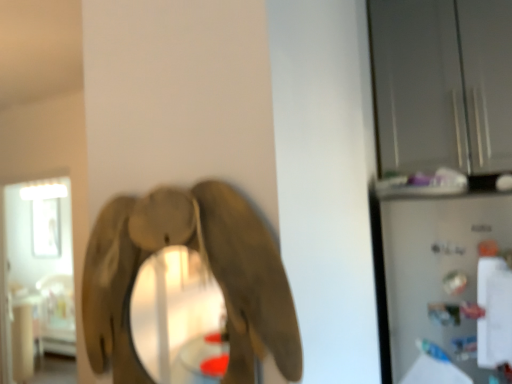
Question: Is transparent glass cabinet at upper right, marked as the 2th glass door in a bottom-to-top arrangement, completely or partially outside of wooden elephant at center?

Choices:
 (A) yes
 (B) no

Answer: (A)

Question: Does transparent glass cabinet at upper right, the second glass door in the left-to-right sequence, have a smaller size compared to wooden elephant at center?

Choices:
 (A) yes
 (B) no

Answer: (B)

Question: From a real-world perspective, is transparent glass cabinet at upper right, acting as the second glass door starting from the back, under wooden elephant at center?

Choices:
 (A) no
 (B) yes

Answer: (A)

Question: Would you say transparent glass cabinet at upper right, marked as the 2th glass door in a bottom-to-top arrangement, contains wooden elephant at center?

Choices:
 (A) no
 (B) yes

Answer: (A)

Question: Is transparent glass cabinet at upper right, which is the 1th glass door from right to left, bigger than wooden elephant at center?

Choices:
 (A) yes
 (B) no

Answer: (A)

Question: From their relative heights in the image, would you say transparent glass door at left, the first glass door positioned from the bottom, is taller or shorter than satin silver refrigerator at right?

Choices:
 (A) short
 (B) tall

Answer: (B)

Question: Is point (26, 221) positioned closer to the camera than point (392, 291)?

Choices:
 (A) farther
 (B) closer

Answer: (A)

Question: From the image's perspective, is transparent glass door at left, the first glass door positioned from the bottom, above or below satin silver refrigerator at right?

Choices:
 (A) above
 (B) below

Answer: (B)

Question: Based on their positions, is transparent glass door at left, the first glass door positioned from the bottom, located to the left or right of satin silver refrigerator at right?

Choices:
 (A) left
 (B) right

Answer: (A)

Question: From a real-world perspective, relative to transparent glass cabinet at upper right, the second glass door in the left-to-right sequence, is transparent glass door at left, arranged as the 2th glass door when viewed from the right, vertically above or below?

Choices:
 (A) below
 (B) above

Answer: (A)

Question: Considering the positions of transparent glass door at left, marked as the second glass door in a top-to-bottom arrangement, and transparent glass cabinet at upper right, acting as the second glass door starting from the back, in the image, is transparent glass door at left, marked as the second glass door in a top-to-bottom arrangement, taller or shorter than transparent glass cabinet at upper right, acting as the second glass door starting from the back,?

Choices:
 (A) tall
 (B) short

Answer: (A)

Question: From the image's perspective, is transparent glass door at left, the 2th glass door positioned from the front, above or below transparent glass cabinet at upper right, the second glass door in the left-to-right sequence?

Choices:
 (A) above
 (B) below

Answer: (B)

Question: Is transparent glass door at left, marked as the second glass door in a top-to-bottom arrangement, inside or outside of transparent glass cabinet at upper right, which is the first glass door from front to back?

Choices:
 (A) outside
 (B) inside

Answer: (A)

Question: Considering their positions, is wooden elephant at center located in front of or behind transparent glass door at left, marked as the second glass door in a top-to-bottom arrangement?

Choices:
 (A) behind
 (B) front

Answer: (B)

Question: Is point (179, 203) positioned closer to the camera than point (36, 276)?

Choices:
 (A) closer
 (B) farther

Answer: (A)